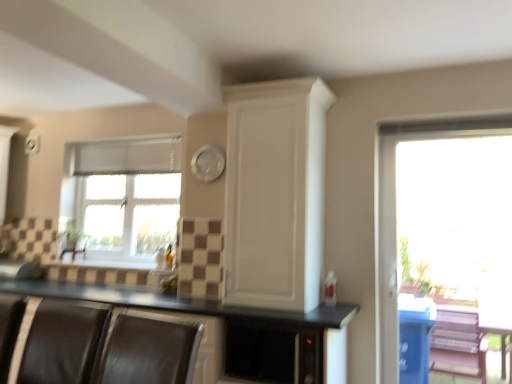
Question: Is white fabric blind at upper left oriented towards brown leather armchair at lower left, the first armchair from the left?

Choices:
 (A) yes
 (B) no

Answer: (B)

Question: Does white fabric blind at upper left have a lesser height compared to brown leather armchair at lower left, which is the second armchair in right-to-left order?

Choices:
 (A) yes
 (B) no

Answer: (B)

Question: Is the surface of white fabric blind at upper left in direct contact with brown leather armchair at lower left, which is the second armchair in right-to-left order?

Choices:
 (A) no
 (B) yes

Answer: (A)

Question: Is white fabric blind at upper left not close to brown leather armchair at lower left, the first armchair from the back?

Choices:
 (A) no
 (B) yes

Answer: (A)

Question: Can you confirm if white fabric blind at upper left is taller than brown leather armchair at lower left, the first armchair from the back?

Choices:
 (A) no
 (B) yes

Answer: (B)

Question: From the image's perspective, is white fabric blind at upper left below brown leather armchair at lower left, the first armchair from the back?

Choices:
 (A) yes
 (B) no

Answer: (B)

Question: From the image's perspective, is white textured window at left, arranged as the 2th window when viewed from the right, beneath black leather armchair at lower left, marked as the first armchair in a front-to-back arrangement?

Choices:
 (A) yes
 (B) no

Answer: (B)

Question: Can you confirm if white textured window at left, acting as the 1th window starting from the back, is wider than black leather armchair at lower left, marked as the 2th armchair in a back-to-front arrangement?

Choices:
 (A) no
 (B) yes

Answer: (A)

Question: Is white textured window at left, which ranks as the first window in left-to-right order, further to camera compared to black leather armchair at lower left, marked as the first armchair in a front-to-back arrangement?

Choices:
 (A) yes
 (B) no

Answer: (A)

Question: Can you confirm if white textured window at left, arranged as the 2th window when viewed from the right, is thinner than black leather armchair at lower left, marked as the first armchair in a front-to-back arrangement?

Choices:
 (A) yes
 (B) no

Answer: (A)

Question: Is black leather armchair at lower left, which is counted as the first armchair, starting from the right, at the back of white textured window at left, acting as the 1th window starting from the back?

Choices:
 (A) yes
 (B) no

Answer: (B)

Question: Considering the relative sizes of white textured window at left, the 2th window viewed from the front, and black leather armchair at lower left, positioned as the 2th armchair in left-to-right order, in the image provided, is white textured window at left, the 2th window viewed from the front, bigger than black leather armchair at lower left, positioned as the 2th armchair in left-to-right order,?

Choices:
 (A) yes
 (B) no

Answer: (A)

Question: Is white matte cabinet at upper center behind white fabric blind at upper left?

Choices:
 (A) yes
 (B) no

Answer: (B)